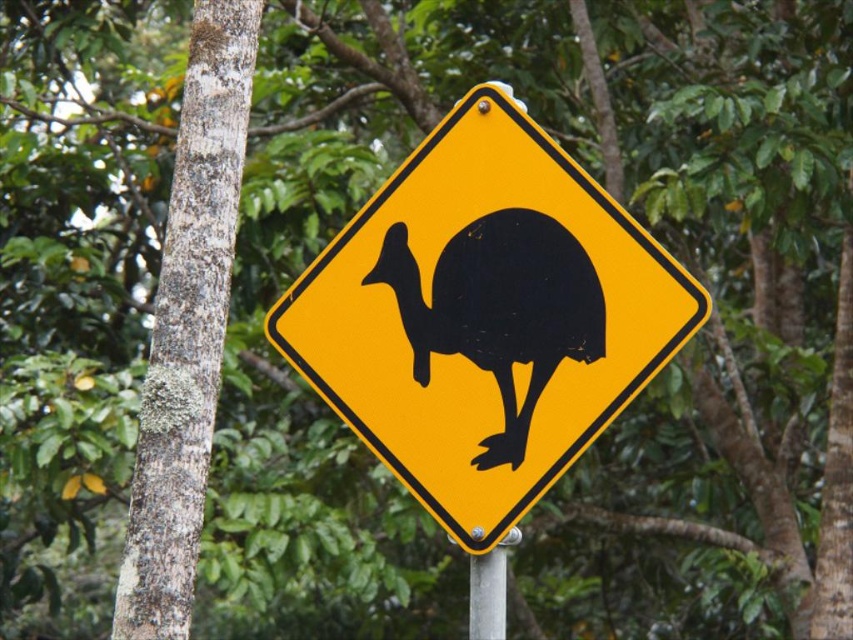
Who is taller, black glossy bird at center or silver metallic pole at center?

With more height is black glossy bird at center.

Measure the distance from black glossy bird at center to silver metallic pole at center.

21.71 centimeters

This screenshot has height=640, width=853. In order to click on black glossy bird at center in this screenshot , I will do `click(498, 308)`.

Is the position of yellow plastic sign at center more distant than that of silver metallic pole at center?

No, yellow plastic sign at center is in front of silver metallic pole at center.

Where is `yellow plastic sign at center`? The image size is (853, 640). yellow plastic sign at center is located at coordinates (485, 317).

What do you see at coordinates (485, 317) in the screenshot? The height and width of the screenshot is (640, 853). I see `yellow plastic sign at center` at bounding box center [485, 317].

Who is positioned more to the left, yellow plastic sign at center or black glossy bird at center?

Positioned to the left is yellow plastic sign at center.

You are a GUI agent. You are given a task and a screenshot of the screen. Output one action in this format:
    pyautogui.click(x=<x>, y=<y>)
    Task: Click on the yellow plastic sign at center
    
    Given the screenshot: What is the action you would take?
    pyautogui.click(x=485, y=317)